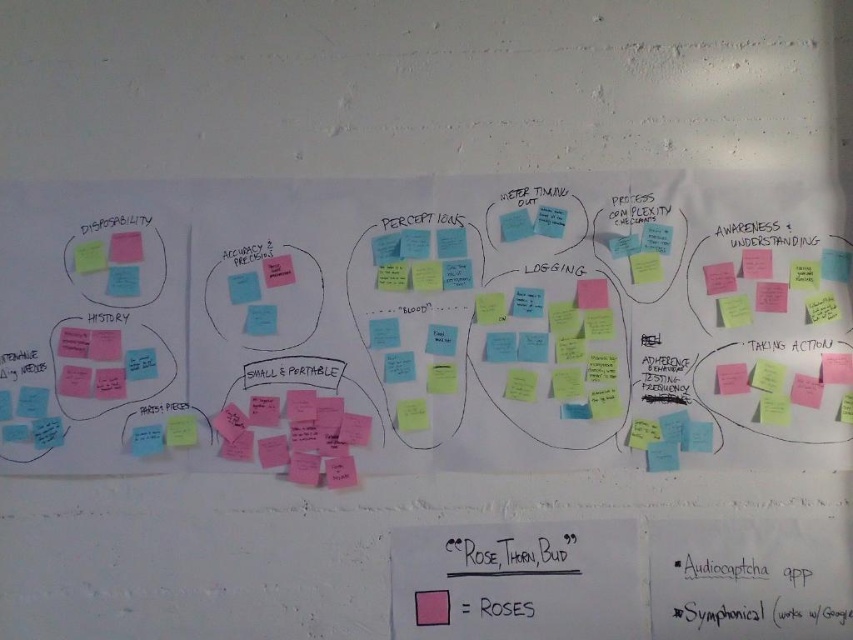
Is pink paper at center above pink paper at lower left?

No, pink paper at center is not above pink paper at lower left.

You are a GUI agent. You are given a task and a screenshot of the screen. Output one action in this format:
    pyautogui.click(x=<x>, y=<y>)
    Task: Click on the pink paper at center
    The height and width of the screenshot is (640, 853).
    Given the screenshot: What is the action you would take?
    pyautogui.click(x=431, y=608)

Does pink paper at lower left appear on the right side of green matte sticky note at upper left?

Correct, you'll find pink paper at lower left to the right of green matte sticky note at upper left.

At what (x,y) coordinates should I click in order to perform the action: click on pink paper at lower left. Please return your answer as a coordinate pair (x, y). The image size is (853, 640). Looking at the image, I should click on (180, 429).

Which is behind, point (82, 307) or point (434, 602)?

Point (434, 602)

From the picture: Between pink sticky notes at left and pink paper at center, which one is positioned higher?

pink sticky notes at left is above.

Between point (65, 349) and point (442, 600), which one is positioned behind?

Point (442, 600)

At what (x,y) coordinates should I click in order to perform the action: click on pink sticky notes at left. Please return your answer as a coordinate pair (x, y). This screenshot has width=853, height=640. Looking at the image, I should click on (427, 324).